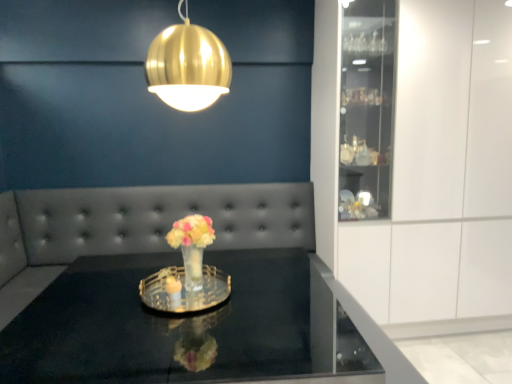
Question: From the image's perspective, is black glass table at center positioned above or below translucent glass vase at center?

Choices:
 (A) below
 (B) above

Answer: (A)

Question: From a real-world perspective, is black glass table at center above or below translucent glass vase at center?

Choices:
 (A) below
 (B) above

Answer: (A)

Question: Estimate the real-world distances between objects in this image. Which object is closer to the black glass table at center?

Choices:
 (A) clear glass tray at center
 (B) translucent glass vase at center
 (C) clear glass vase at center
 (D) white glossy cabinet at right
 (E) gold metallic sphere at upper center

Answer: (A)

Question: Based on their relative distances, which object is nearer to the white glossy cabinet at right?

Choices:
 (A) clear glass vase at center
 (B) black glass table at center
 (C) clear glass tray at center
 (D) gold metallic sphere at upper center
 (E) translucent glass vase at center

Answer: (A)